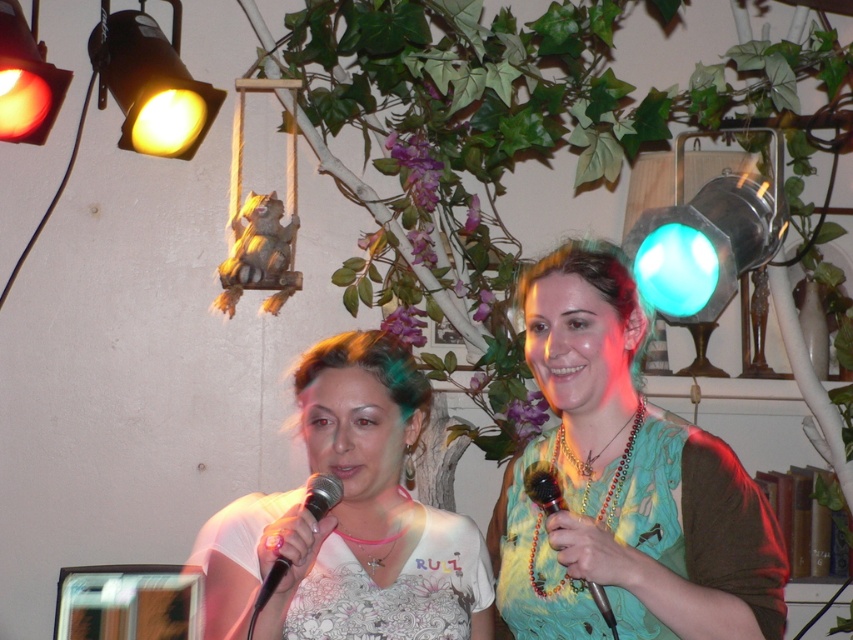
You are a stagehand setting up for a performance. You need to ensure that the matte yellow spotlight at upper left and the wooden beaded microphone at center are visible to the audience. Considering their sizes, which object might require additional lighting adjustments to ensure visibility?

The wooden beaded microphone at center might require additional lighting adjustments because it is smaller in size compared to the matte yellow spotlight at upper left.

You are a photographer standing 10 feet away from the camera. You want to take a photo of the shiny green dress at right without moving the camera. Can you adjust your position so that you are closer to the dress than the camera?

The shiny green dress at right and camera are 5.50 feet apart. Since you are 10 feet away from the camera, the minimum distance between you and the dress would be 10 feet minus 5.50 feet, which equals 4.5 feet. Therefore, you can position yourself closer to the dress than the camera by moving towards it within that 5.50 feet distance between them.

You are setting up a stage for a karaoke night and need to ensure that the matte orange spotlight at upper left and the black metallic microphone at center are positioned correctly. Which object is wider?

The matte orange spotlight at upper left is wider than the black metallic microphone at center according to the description.